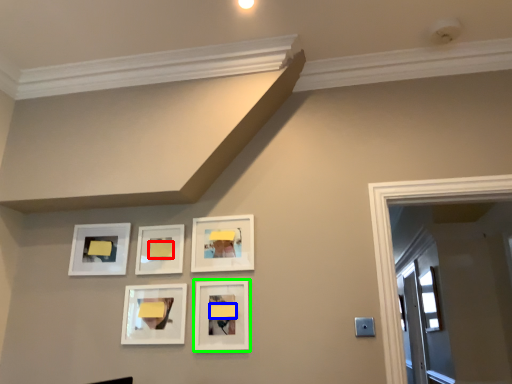
Question: Which object is positioned farthest from lift (highlighted by a red box)? Select from lift (highlighted by a blue box) and picture frame (highlighted by a green box).

Choices:
 (A) lift
 (B) picture frame

Answer: (B)